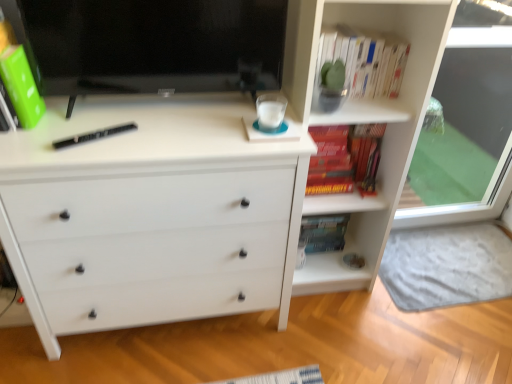
Where is `free space in front of matte black monitor at upper left`? Image resolution: width=512 pixels, height=384 pixels. free space in front of matte black monitor at upper left is located at coordinates (147, 137).